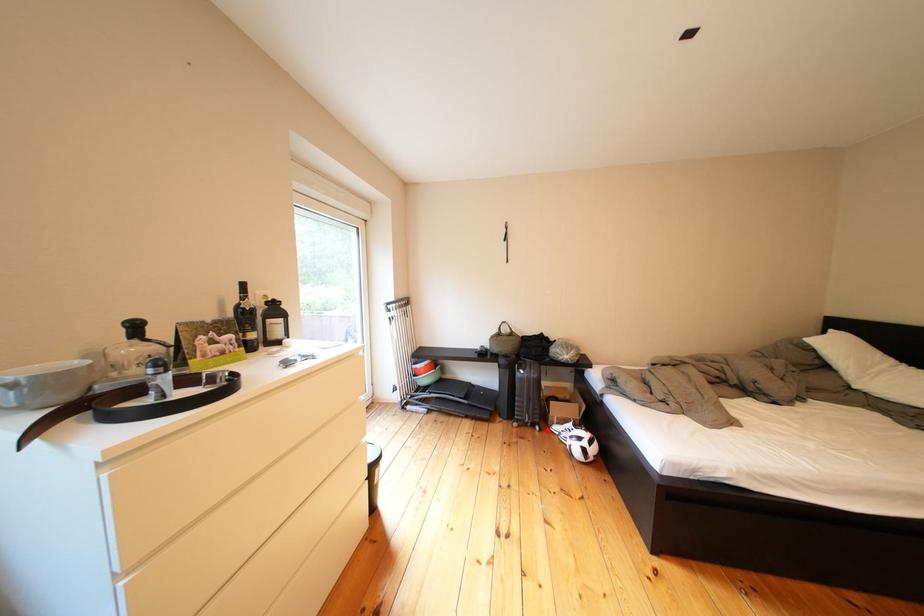
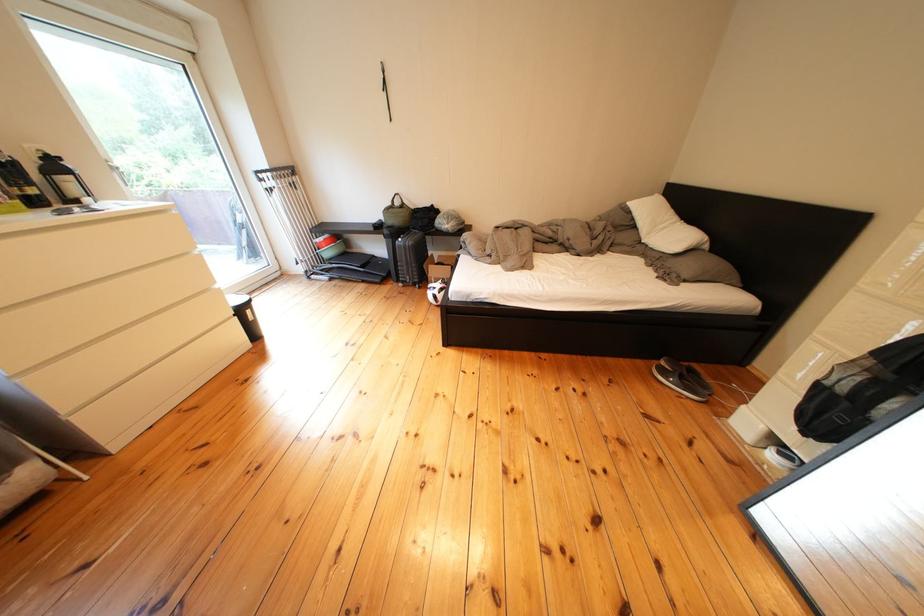
Find the pixel in the second image that matches the highlighted location in the first image.

(429, 290)